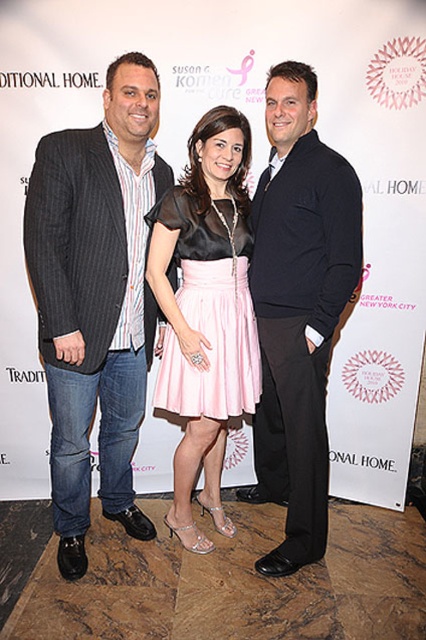
Question: Is dark blue sweater at center in front of pink satin skirt at center?

Choices:
 (A) yes
 (B) no

Answer: (A)

Question: Which of the following is the closest to the observer?

Choices:
 (A) pink satin skirt at center
 (B) striped cotton shirt at left

Answer: (B)

Question: Which object appears farthest from the camera in this image?

Choices:
 (A) dark blue sweater at center
 (B) pink satin skirt at center
 (C) striped cotton shirt at left

Answer: (B)

Question: Is dark blue sweater at center positioned before pink satin skirt at center?

Choices:
 (A) no
 (B) yes

Answer: (B)

Question: Which of the following is the farthest from the observer?

Choices:
 (A) (313, 218)
 (B) (210, 336)
 (C) (103, 243)

Answer: (B)

Question: Is dark blue sweater at center below pink satin skirt at center?

Choices:
 (A) no
 (B) yes

Answer: (B)